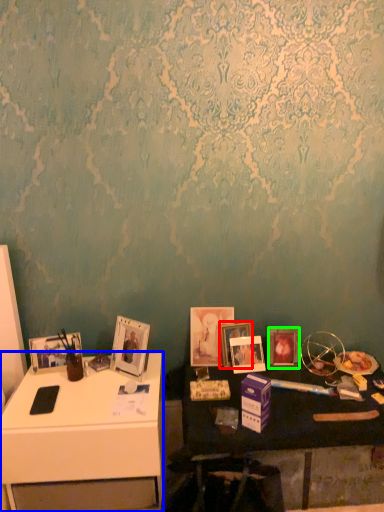
Question: Which is nearer to the picture frame (highlighted by a red box)? desk (highlighted by a blue box) or picture frame (highlighted by a green box).

Choices:
 (A) desk
 (B) picture frame

Answer: (B)